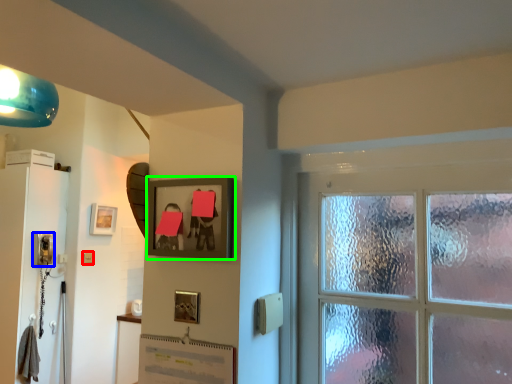
Question: Considering the real-world distances, which object is farthest from light switch (highlighted by a red box)? corded phone (highlighted by a blue box) or picture frame (highlighted by a green box)?

Choices:
 (A) corded phone
 (B) picture frame

Answer: (B)